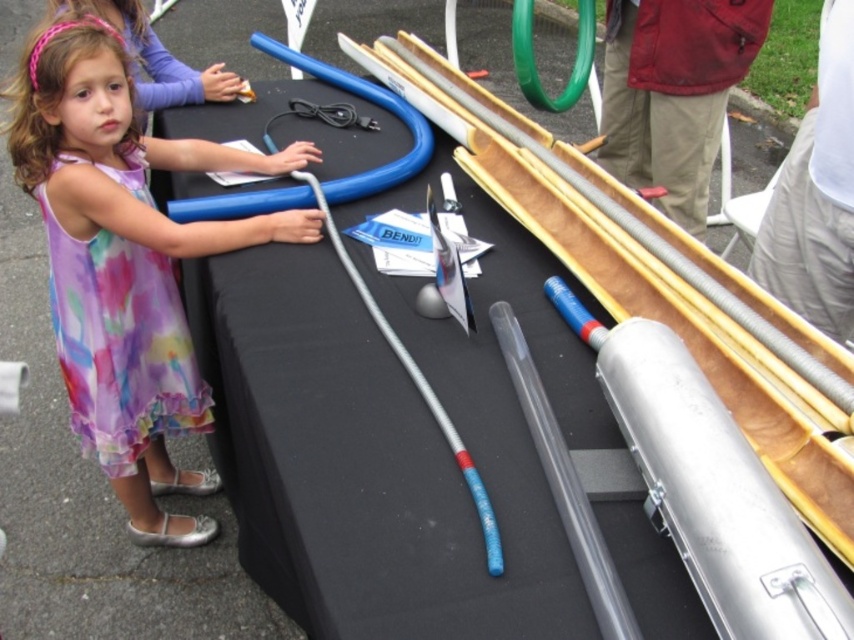
You are standing 40 inches away from the black fabric table at center. Can you reach it without moving your feet?

The black fabric table at center is 38.87 inches away from the viewer, so yes, you can reach it without moving your feet since it is within the 40 inches distance.

You are an event planner trying to set up a booth. You have a black fabric table at center and a matte purple dress at center. Which object takes up more space in the image?

The black fabric table at center has a larger size compared to the matte purple dress at center, so it takes up more space in the image.